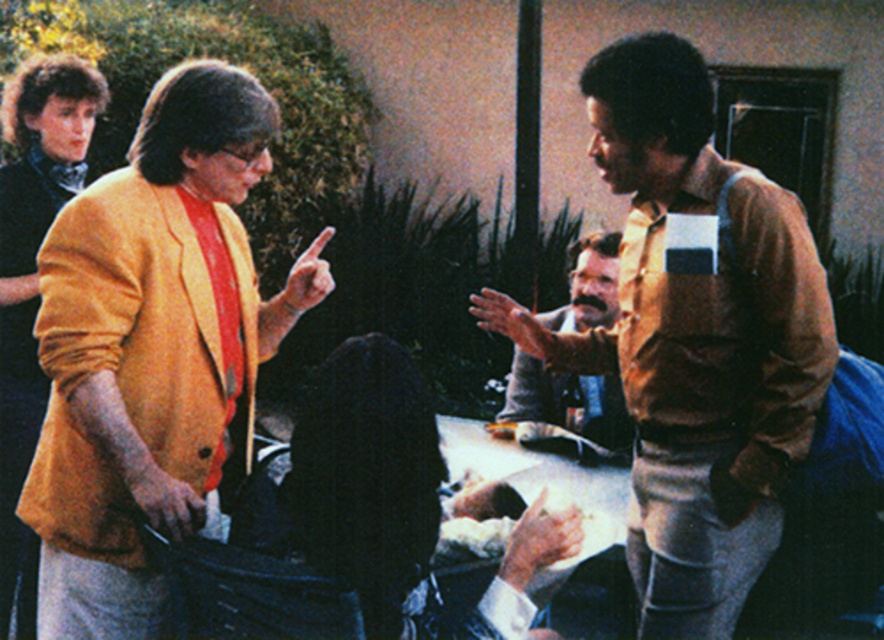
Question: From the image, what is the correct spatial relationship of brown textured shirt at right in relation to black fabric jacket at center?

Choices:
 (A) left
 (B) right

Answer: (B)

Question: Can you confirm if matte yellow jacket at left is smaller than brown textured shirt at right?

Choices:
 (A) yes
 (B) no

Answer: (A)

Question: Considering the real-world distances, which object is closest to the matte yellow jacket at left?

Choices:
 (A) bearded man at center
 (B) matte yellow sweater at upper left
 (C) brown textured shirt at right
 (D) black fabric jacket at center

Answer: (D)

Question: Which object is positioned farthest from the black fabric jacket at center?

Choices:
 (A) brown textured shirt at right
 (B) matte yellow jacket at left
 (C) matte yellow sweater at upper left
 (D) bearded man at center

Answer: (D)

Question: Can you confirm if brown textured shirt at right is bigger than matte yellow sweater at upper left?

Choices:
 (A) yes
 (B) no

Answer: (A)

Question: Which object is farther from the camera taking this photo?

Choices:
 (A) matte yellow jacket at left
 (B) brown textured shirt at right
 (C) black fabric jacket at center
 (D) bearded man at center

Answer: (D)